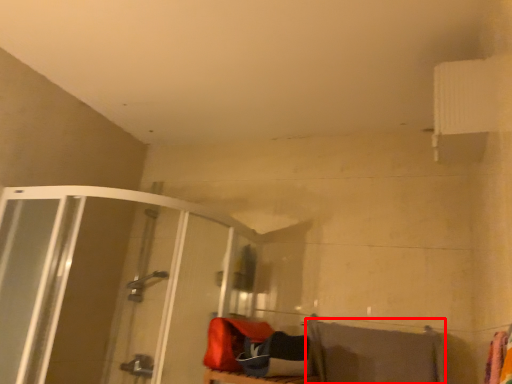
Question: Where is beach towel (annotated by the red box) located in relation to shower door in the image?

Choices:
 (A) left
 (B) right

Answer: (B)